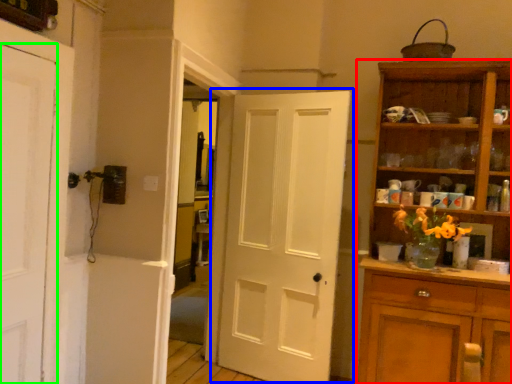
Question: Based on their relative distances, which object is nearer to cupboard (highlighted by a red box)? Choose from door (highlighted by a blue box) and door (highlighted by a green box).

Choices:
 (A) door
 (B) door

Answer: (A)